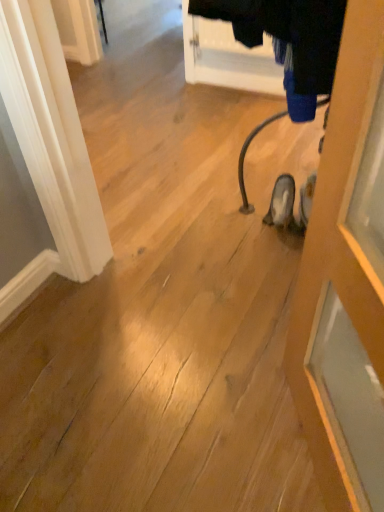
Locate an element on the screen. The height and width of the screenshot is (512, 384). vacant area situated below black fabric screen door at upper center (from a real-world perspective) is located at coordinates (233, 90).